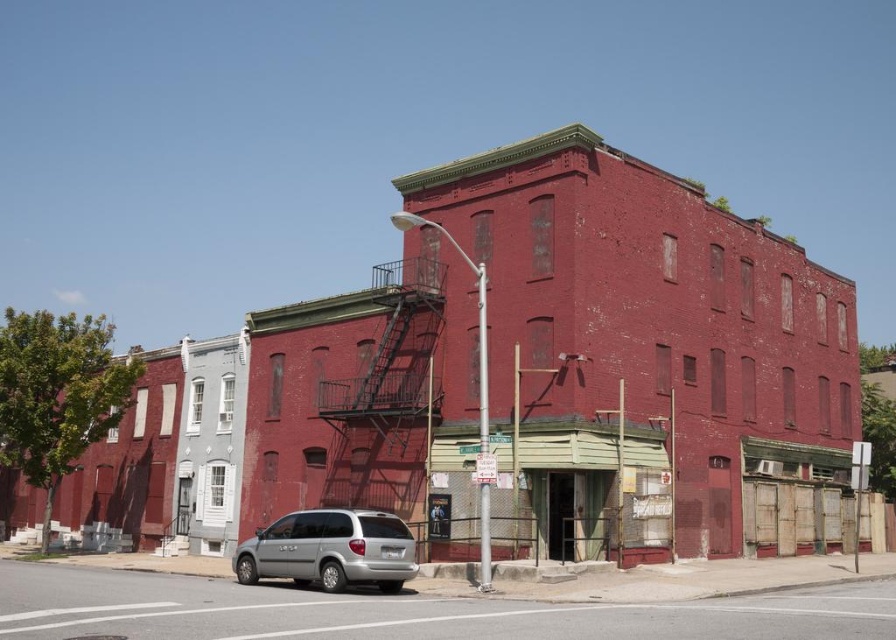
Question: Can you confirm if rusty metal fire escape at center is smaller than silver metallic minivan at lower center?

Choices:
 (A) no
 (B) yes

Answer: (A)

Question: Which point is closer to the camera?

Choices:
 (A) silver metallic minivan at lower center
 (B) rusty metal fire escape at center

Answer: (A)

Question: Which point is farther to the camera?

Choices:
 (A) rusty metal fire escape at center
 (B) silver metallic minivan at lower center

Answer: (A)

Question: Can you confirm if rusty metal fire escape at center is positioned to the right of silver metallic minivan at lower center?

Choices:
 (A) yes
 (B) no

Answer: (B)

Question: Does rusty metal fire escape at center come behind silver metallic minivan at lower center?

Choices:
 (A) yes
 (B) no

Answer: (A)